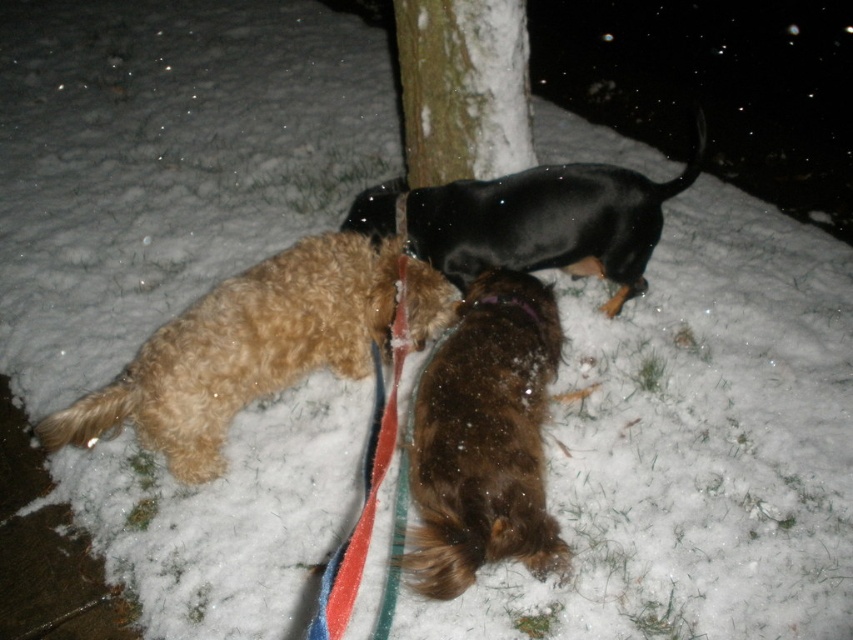
You are standing at the center of the snowy scene and want to find the fuzzy brown dog at lower left. Based on the coordinates provided in the Objects Description, in which cardinal direction should you look to locate it?

The fuzzy brown dog at lower left is located at coordinates point (242, 349). Since the coordinate system typically places the origin at the bottom left corner, a higher x value moves right and a higher y value moves up. Therefore, to locate the fuzzy brown dog at lower left from the center, you should look to the left and slightly downward.